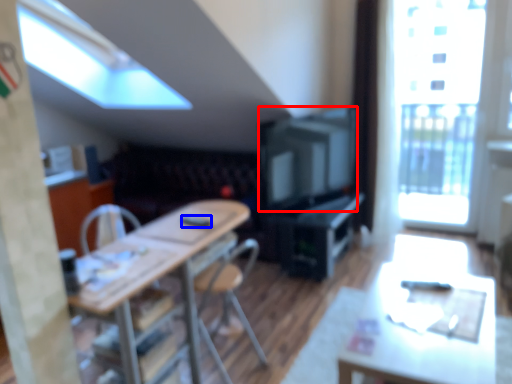
Question: Which point is further to the camera, television (highlighted by a red box) or remote control (highlighted by a blue box)?

Choices:
 (A) television
 (B) remote control

Answer: (A)